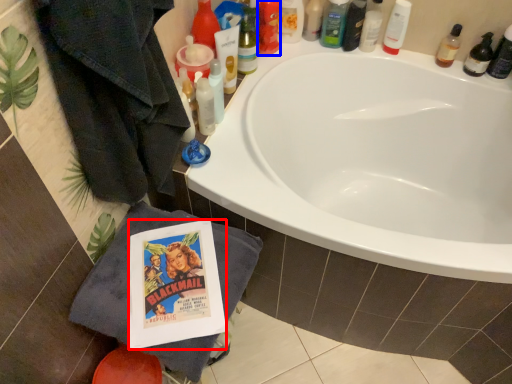
Question: Among these objects, which one is farthest to the camera, comic book (highlighted by a red box) or toiletry (highlighted by a blue box)?

Choices:
 (A) comic book
 (B) toiletry

Answer: (B)